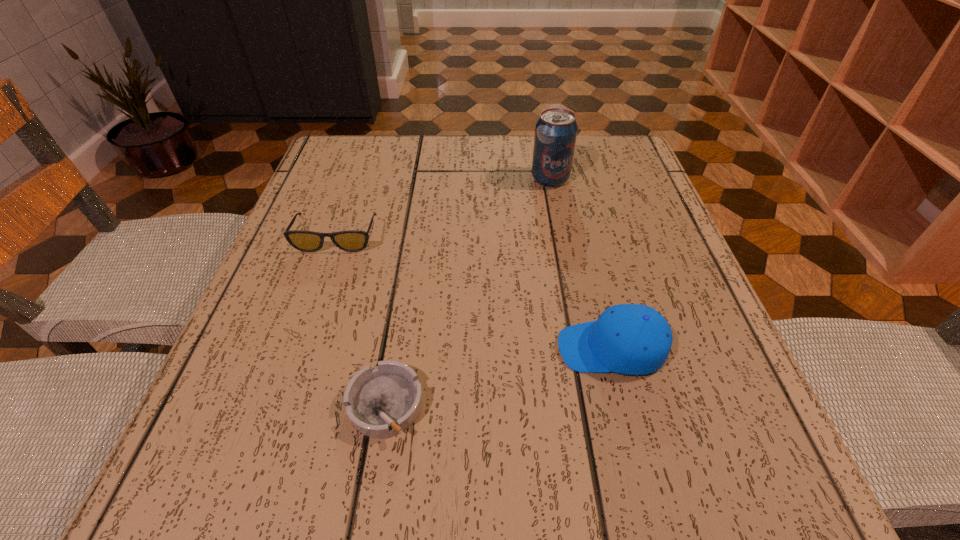
Locate an element on the screen. The height and width of the screenshot is (540, 960). vacant space located 0.110m on the front-facing side of the cap is located at coordinates (486, 348).

Identify the location of vacant area situated 0.180m on the front-facing side of the sunglasses. This screenshot has width=960, height=540. (305, 329).

This screenshot has width=960, height=540. Find the location of `vacant space positioned on the back of the shortest object`. vacant space positioned on the back of the shortest object is located at coordinates (418, 209).

At what (x,y) coordinates should I click in order to perform the action: click on object that is at the far edge. Please return your answer as a coordinate pair (x, y). Looking at the image, I should click on (556, 130).

At what (x,y) coordinates should I click in order to perform the action: click on object situated at the near edge. Please return your answer as a coordinate pair (x, y). The image size is (960, 540). Looking at the image, I should click on (381, 402).

This screenshot has height=540, width=960. Identify the location of object that is positioned at the left edge. (308, 241).

Where is `object situated at the right edge`? This screenshot has width=960, height=540. object situated at the right edge is located at coordinates (631, 339).

In order to click on vacant space at the far edge in this screenshot , I will do `click(424, 151)`.

The height and width of the screenshot is (540, 960). In the image, there is a desktop. Identify the location of vacant space at the left edge. (333, 292).

Image resolution: width=960 pixels, height=540 pixels. What are the coordinates of `vacant space at the right edge` in the screenshot? It's located at (643, 297).